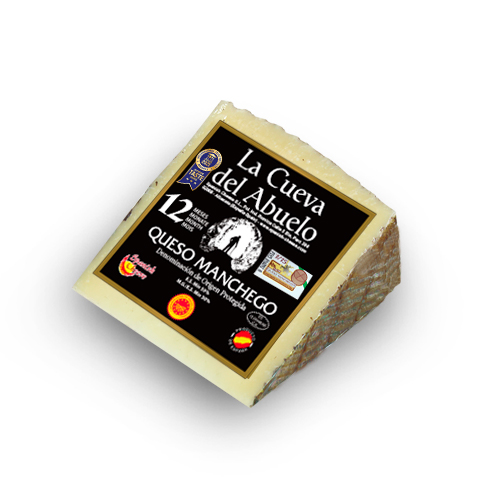
Locate an element on the screen. This screenshot has height=500, width=500. knife to cut cheese is located at coordinates (265, 325).